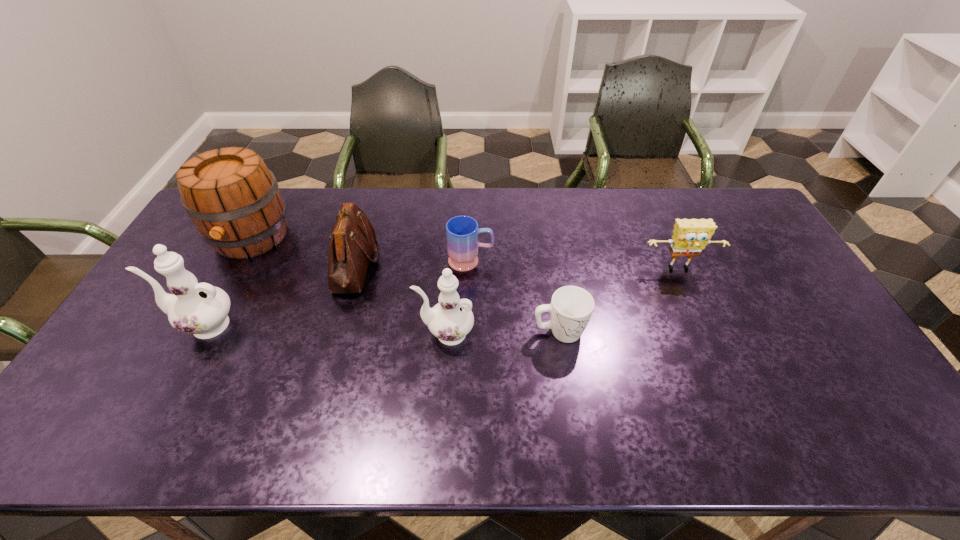
Find the location of a particular element. The image size is (960, 540). free point that keeps the chinawares evenly spaced on the right is located at coordinates (695, 342).